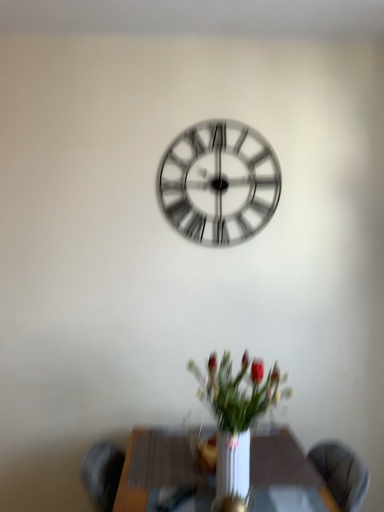
Question: From the image's perspective, is metallic silver clock at center located beneath white glossy vase at center?

Choices:
 (A) yes
 (B) no

Answer: (B)

Question: Could you tell me if metallic silver clock at center is facing white glossy vase at center?

Choices:
 (A) yes
 (B) no

Answer: (B)

Question: Is metallic silver clock at center at the left side of white glossy vase at center?

Choices:
 (A) yes
 (B) no

Answer: (A)

Question: Is metallic silver clock at center to the right of white glossy vase at center from the viewer's perspective?

Choices:
 (A) yes
 (B) no

Answer: (B)

Question: Can you confirm if metallic silver clock at center is smaller than white glossy vase at center?

Choices:
 (A) no
 (B) yes

Answer: (B)

Question: Is metallic silver clock at center not inside white glossy vase at center?

Choices:
 (A) yes
 (B) no

Answer: (A)

Question: Considering the relative positions of white glossy vase at center and metallic silver clock at center in the image provided, is white glossy vase at center to the left of metallic silver clock at center from the viewer's perspective?

Choices:
 (A) no
 (B) yes

Answer: (A)

Question: From a real-world perspective, is white glossy vase at center on metallic silver clock at center?

Choices:
 (A) yes
 (B) no

Answer: (B)

Question: Can you see white glossy vase at center touching metallic silver clock at center?

Choices:
 (A) no
 (B) yes

Answer: (A)

Question: From the image's perspective, is white glossy vase at center under metallic silver clock at center?

Choices:
 (A) yes
 (B) no

Answer: (A)

Question: Is white glossy vase at center facing towards metallic silver clock at center?

Choices:
 (A) no
 (B) yes

Answer: (A)

Question: Does white glossy vase at center appear on the right side of metallic silver clock at center?

Choices:
 (A) yes
 (B) no

Answer: (A)

Question: Can you confirm if white glossy vase at center is shorter than wooden table at center?

Choices:
 (A) yes
 (B) no

Answer: (B)